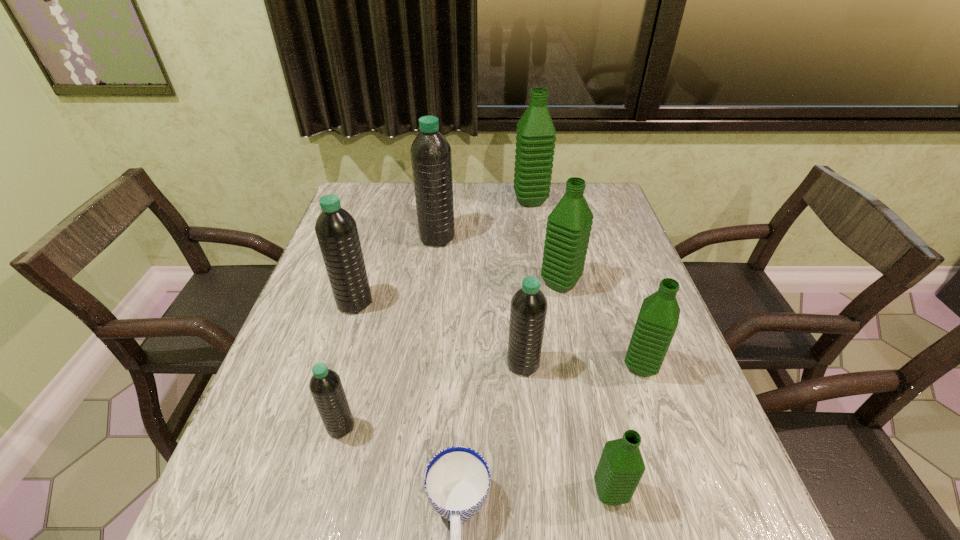
Find the location of a particular element. vacant point located between the second farthest black water bottle and the second nearest black water bottle is located at coordinates (439, 334).

I want to click on free point between the second nearest green water bottle and the second farthest green water bottle, so click(601, 325).

I want to click on vacant area that lies between the third farthest green water bottle and the third nearest black water bottle, so click(x=497, y=334).

Identify the location of vacant region between the seventh nearest water bottle and the third farthest black water bottle. This screenshot has height=540, width=960. (480, 301).

Locate an element on the screen. empty space that is in between the third farthest black water bottle and the third nearest black water bottle is located at coordinates (439, 334).

Locate an element on the screen. Image resolution: width=960 pixels, height=540 pixels. object that can be found as the second closest to the second nearest water bottle is located at coordinates (336, 230).

This screenshot has height=540, width=960. Find the location of `object that stands as the seventh closest to the third farthest black water bottle`. object that stands as the seventh closest to the third farthest black water bottle is located at coordinates (431, 159).

Where is `water bottle identified as the fourth closest to the second farthest black water bottle`? The height and width of the screenshot is (540, 960). water bottle identified as the fourth closest to the second farthest black water bottle is located at coordinates (568, 229).

In order to click on water bottle identified as the second closest to the smallest green water bottle in this screenshot , I will do `click(528, 309)`.

Identify which black water bottle is located as the second nearest to the second biggest black water bottle. Please provide its 2D coordinates. Your answer should be formatted as a tuple, i.e. [(x, y)], where the tuple contains the x and y coordinates of a point satisfying the conditions above.

[(325, 385)]